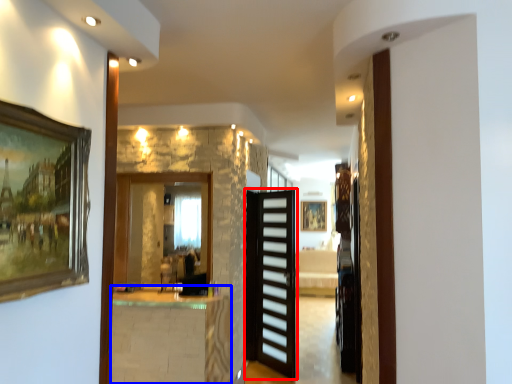
Question: Which point is further to the camera, door (highlighted by a red box) or table (highlighted by a blue box)?

Choices:
 (A) door
 (B) table

Answer: (A)